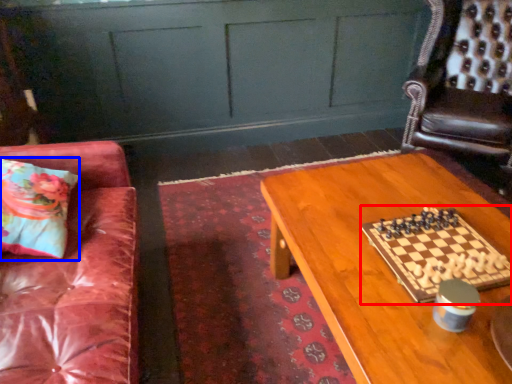
Question: Which of the following is the closest to the observer, board game (highlighted by a red box) or pillow (highlighted by a blue box)?

Choices:
 (A) board game
 (B) pillow

Answer: (A)